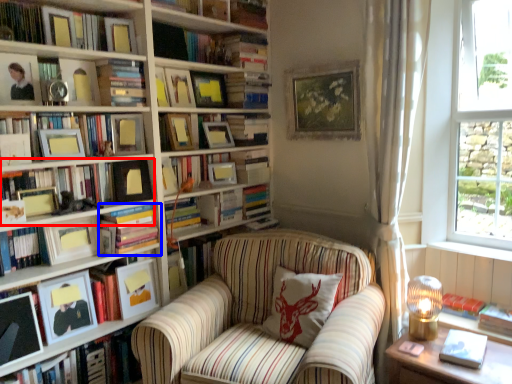
Question: Which of the following is the closest to the observer, book (highlighted by a red box) or book (highlighted by a blue box)?

Choices:
 (A) book
 (B) book

Answer: (A)